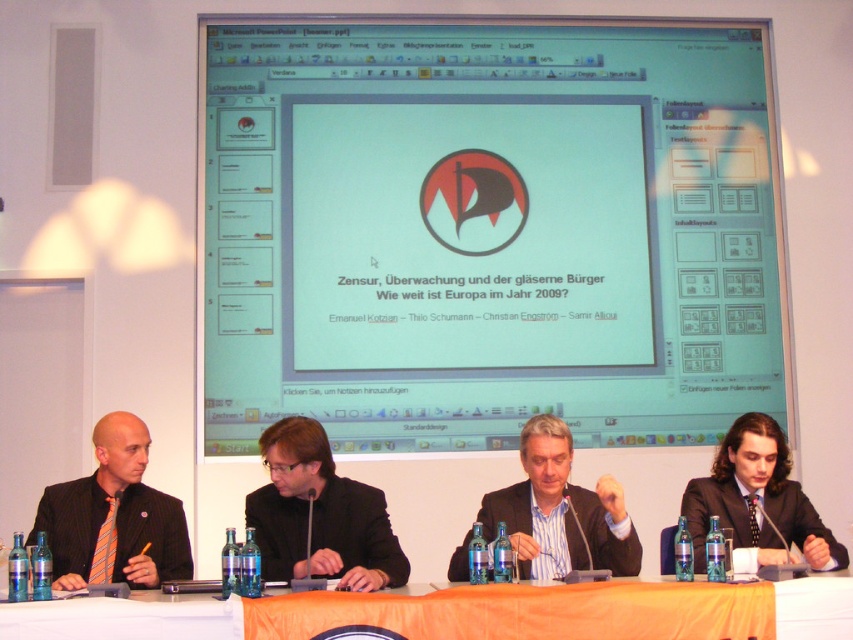
You are a photographer standing in front of the table. You want to place a small decorative item on the orange fabric table at lower center. The item must be placed exactly at the point with coordinates [125,618]. Can you confirm if this point is on the orange fabric table at lower center?

The point with coordinates [125,618] corresponds to the orange fabric table at lower center, so yes, placing the item there would be on the orange fabric table at lower center.

You are attending a conference and need to identify the speaker wearing an orange striped tie at left and the one in a dark brown suit at right. If you are facing the stage, which speaker is positioned higher in the image?

The orange striped tie at left is located above the dark brown suit at right, so the speaker with the orange striped tie at left is positioned higher in the image.